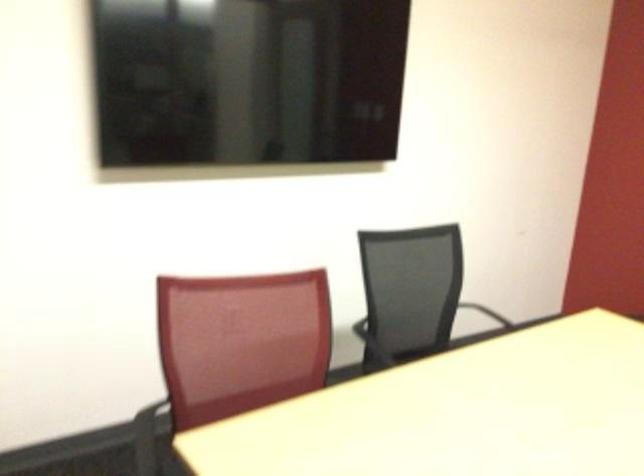
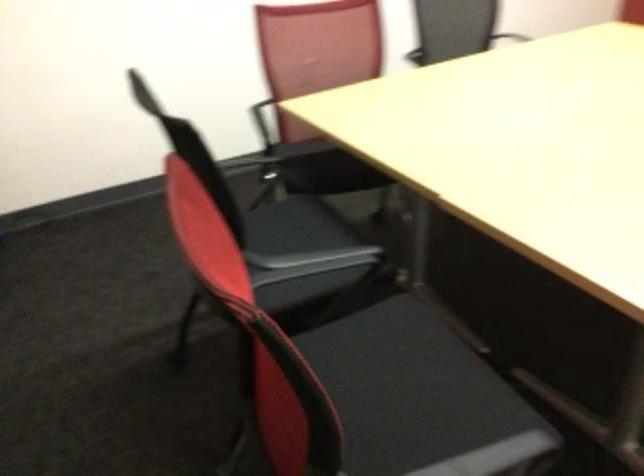
Question: The images are taken continuously from a first-person perspective. In which direction are you moving?

Choices:
 (A) Left
 (B) Right
 (C) Forward
 (D) Backward

Answer: (D)